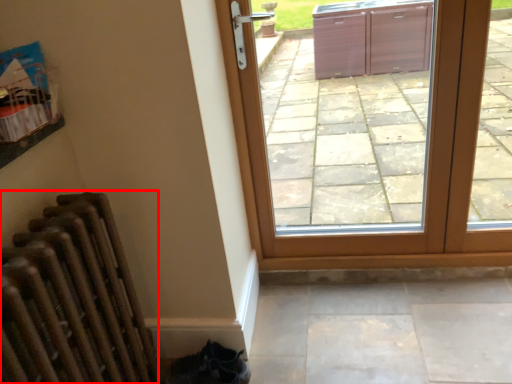
Question: From the image, what is the correct spatial relationship of radiator (annotated by the red box) in relation to door?

Choices:
 (A) right
 (B) left

Answer: (B)